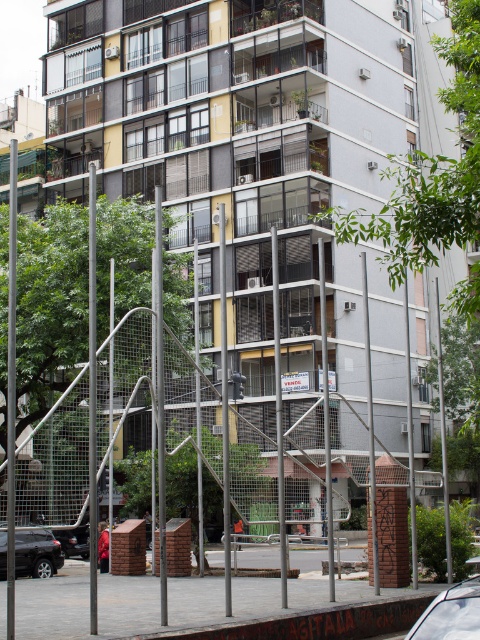
Question: Is the position of metal mesh fence at center less distant than that of black matte suv at lower left?

Choices:
 (A) yes
 (B) no

Answer: (A)

Question: Among these objects, which one is farthest from the camera?

Choices:
 (A) black matte suv at lower left
 (B) metal mesh fence at center
 (C) white glossy car at lower right
 (D) black matte car at lower left

Answer: (A)

Question: Is metal mesh fence at center to the right of black matte suv at lower left from the viewer's perspective?

Choices:
 (A) no
 (B) yes

Answer: (B)

Question: Among these points, which one is nearest to the camera?

Choices:
 (A) (156, 339)
 (B) (66, 544)
 (C) (411, 627)

Answer: (C)

Question: Can you confirm if metal mesh fence at center is positioned below black matte suv at lower left?

Choices:
 (A) yes
 (B) no

Answer: (B)

Question: Among these points, which one is farthest from the camera?

Choices:
 (A) (444, 621)
 (B) (46, 541)
 (C) (240, 417)

Answer: (B)